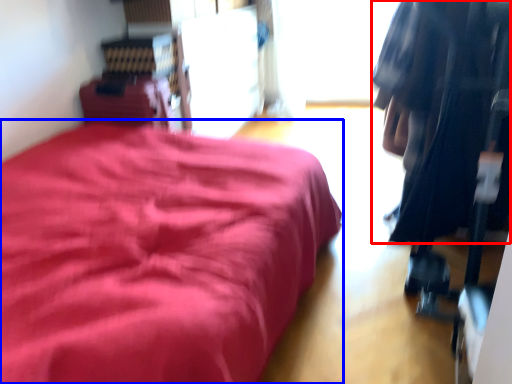
Question: Which object appears closest to the camera in this image, clothing (highlighted by a red box) or furniture (highlighted by a blue box)?

Choices:
 (A) clothing
 (B) furniture

Answer: (B)